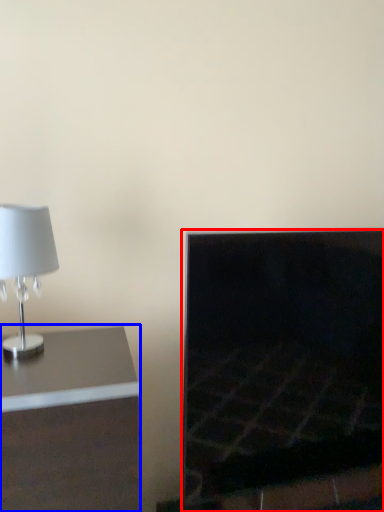
Question: Among these objects, which one is farthest to the camera, fireplace (highlighted by a red box) or furniture (highlighted by a blue box)?

Choices:
 (A) fireplace
 (B) furniture

Answer: (A)